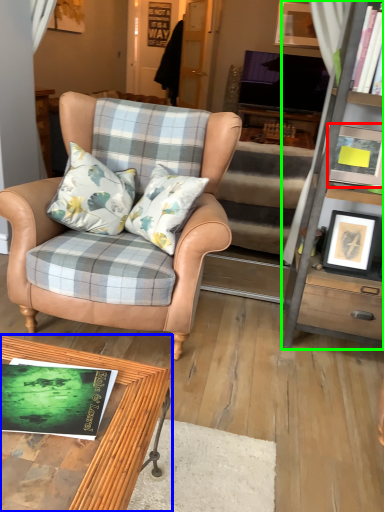
Question: Which is nearer to the picture frame (highlighted by a red box)? coffee table (highlighted by a blue box) or cabinetry (highlighted by a green box).

Choices:
 (A) coffee table
 (B) cabinetry

Answer: (B)